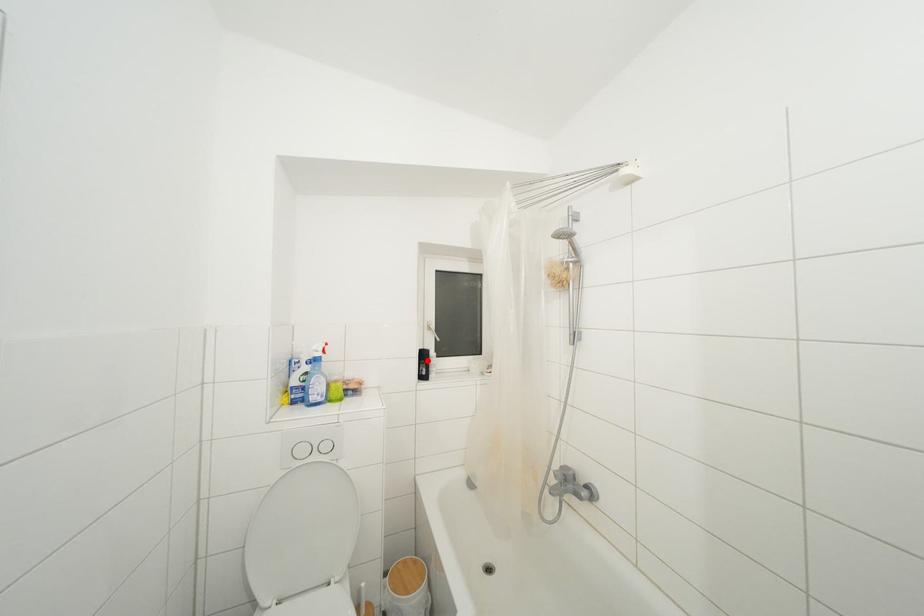
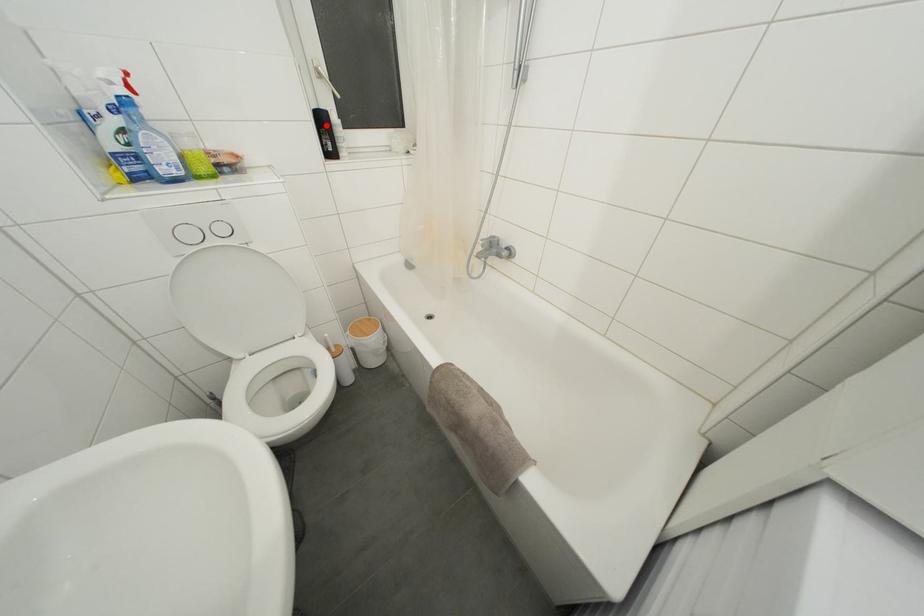
I am providing you with two images of the same scene from different viewpoints. A red point is marked on the first image and another point is marked on the second image. Is the red point in image1 aligned with the point shown in image2?

Yes